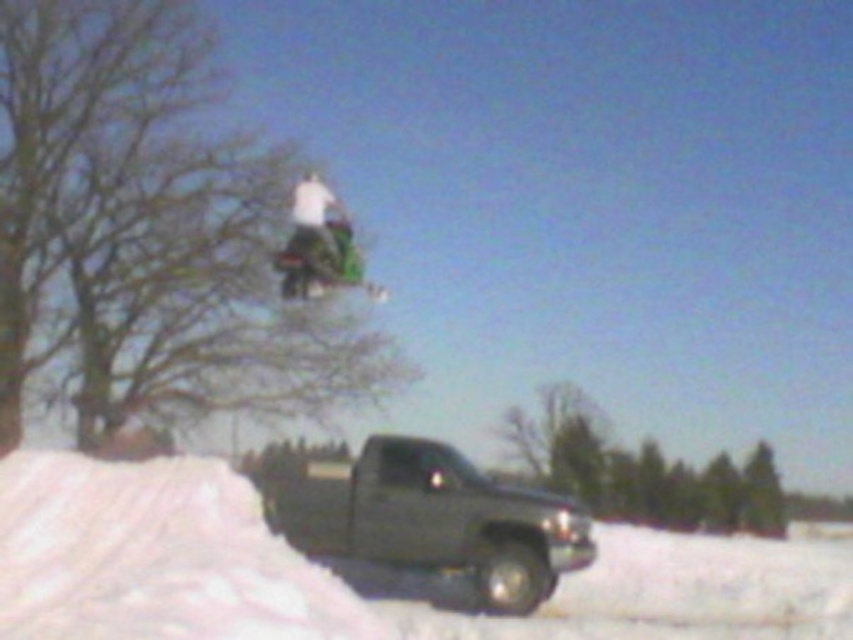
Between point (561, 545) and point (283, 285), which one is positioned in front?

Positioned in front is point (561, 545).

Identify the location of matte black truck at lower center. The image size is (853, 640). (433, 518).